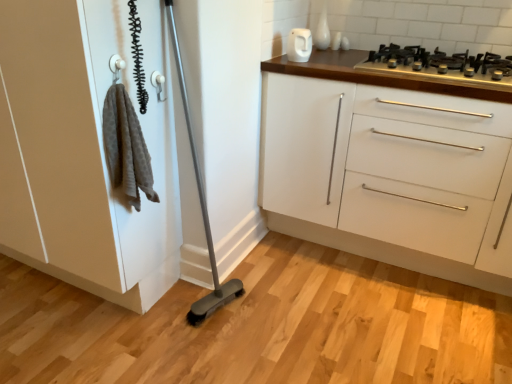
Question: Is white glossy electric kettle at upper center turned away from white plastic door handle at upper center?

Choices:
 (A) no
 (B) yes

Answer: (A)

Question: Could you tell me if white glossy electric kettle at upper center is facing white plastic door handle at upper center?

Choices:
 (A) yes
 (B) no

Answer: (A)

Question: From the image's perspective, does white glossy electric kettle at upper center appear lower than white plastic door handle at upper center?

Choices:
 (A) yes
 (B) no

Answer: (B)

Question: From the image's perspective, is white glossy electric kettle at upper center on top of white plastic door handle at upper center?

Choices:
 (A) yes
 (B) no

Answer: (A)

Question: Is white glossy electric kettle at upper center positioned behind white plastic door handle at upper center?

Choices:
 (A) no
 (B) yes

Answer: (B)

Question: Is white plastic door handle at upper center surrounded by white glossy electric kettle at upper center?

Choices:
 (A) yes
 (B) no

Answer: (B)

Question: Are white glossy electric kettle at upper center and white matte cabinet at left making contact?

Choices:
 (A) no
 (B) yes

Answer: (A)

Question: Can you confirm if white glossy electric kettle at upper center is thinner than white matte cabinet at left?

Choices:
 (A) no
 (B) yes

Answer: (B)

Question: From a real-world perspective, is white glossy electric kettle at upper center physically above white matte cabinet at left?

Choices:
 (A) yes
 (B) no

Answer: (A)

Question: Is white glossy electric kettle at upper center wider than white matte cabinet at left?

Choices:
 (A) no
 (B) yes

Answer: (A)

Question: Is white glossy electric kettle at upper center taller than white matte cabinet at left?

Choices:
 (A) no
 (B) yes

Answer: (A)

Question: Does white glossy electric kettle at upper center have a smaller size compared to white matte cabinet at left?

Choices:
 (A) yes
 (B) no

Answer: (A)

Question: Can you confirm if white glossy cabinet at upper right is taller than white plastic door handle at upper center?

Choices:
 (A) yes
 (B) no

Answer: (A)